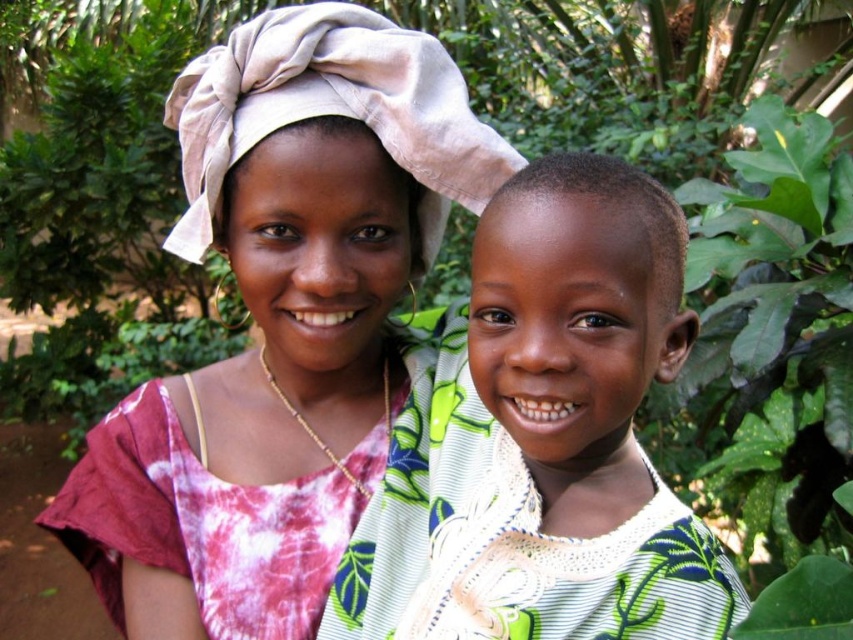
Measure the distance between green leafy fabric at center and camera.

A distance of 22.63 inches exists between green leafy fabric at center and camera.

Can you confirm if green leafy fabric at center is positioned above smooth skin head at center?

Incorrect, green leafy fabric at center is not positioned above smooth skin head at center.

The height and width of the screenshot is (640, 853). What do you see at coordinates (543, 436) in the screenshot? I see `green leafy fabric at center` at bounding box center [543, 436].

At what (x,y) coordinates should I click in order to perform the action: click on green leafy fabric at center. Please return your answer as a coordinate pair (x, y). The width and height of the screenshot is (853, 640). Looking at the image, I should click on (543, 436).

Who is more distant from viewer, [74,508] or [567,380]?

The point [74,508] is behind.

Is matte tie-dye blouse at center closer to camera compared to smooth skin head at center?

No, it is behind smooth skin head at center.

Between point (387, 337) and point (633, 237), which one is positioned in front?

Point (633, 237)

Image resolution: width=853 pixels, height=640 pixels. What are the coordinates of `matte tie-dye blouse at center` in the screenshot? It's located at (280, 333).

Does matte tie-dye blouse at center have a greater width compared to green leafy fabric at center?

Correct, the width of matte tie-dye blouse at center exceeds that of green leafy fabric at center.

Who is shorter, matte tie-dye blouse at center or green leafy fabric at center?

With less height is green leafy fabric at center.

Is point (421, 124) closer to camera compared to point (430, 337)?

That is True.

The width and height of the screenshot is (853, 640). I want to click on matte tie-dye blouse at center, so click(280, 333).